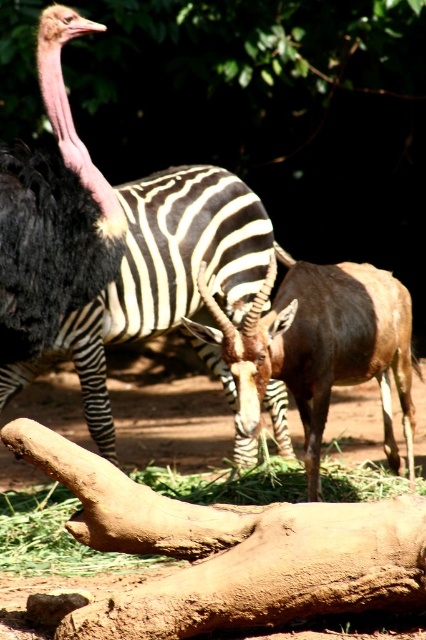
You are a zookeeper observing the brown glossy antelope at center and the black feathered ostrich at left. Which animal is positioned lower in the enclosure?

The brown glossy antelope at center is located below the black feathered ostrich at left, so the antelope is positioned lower.

Based on the coordinates provided, where is the black and white striped zebra at center located in the image?

The black and white striped zebra at center is located at coordinates point (160, 276).

You are a zookeeper observing the animals in the enclosure. You notice the black and white striped zebra at center and the black feathered ostrich at left. Which animal is positioned more to the right side of the scene?

The black and white striped zebra at center is positioned more to the right side of the scene compared to the black feathered ostrich at left.